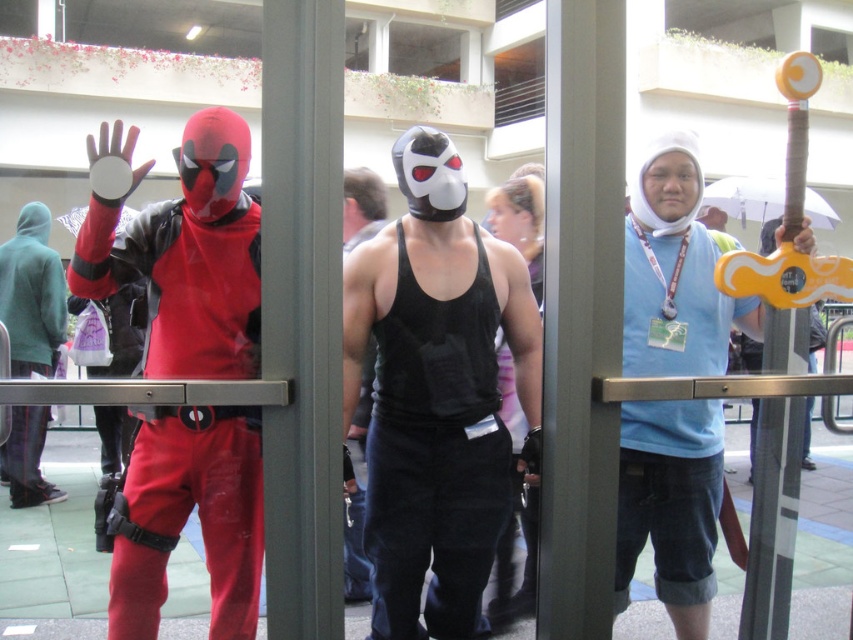
Describe the element at coordinates (436, 394) in the screenshot. I see `black matte tank top at center` at that location.

Who is more forward, (413, 563) or (657, 372)?

Positioned in front is point (413, 563).

Where is `black matte tank top at center`? This screenshot has height=640, width=853. black matte tank top at center is located at coordinates (436, 394).

Can you confirm if black matte tank top at center is thinner than matte red costume at left?

Yes, black matte tank top at center is thinner than matte red costume at left.

Can you confirm if black matte tank top at center is positioned to the left of matte red costume at left?

In fact, black matte tank top at center is to the right of matte red costume at left.

Is point (421, 227) closer to camera compared to point (252, 317)?

That is False.

At what (x,y) coordinates should I click in order to perform the action: click on black matte tank top at center. Please return your answer as a coordinate pair (x, y). This screenshot has height=640, width=853. Looking at the image, I should click on (436, 394).

Does matte red costume at left have a greater width compared to matte black hoodie at left?

Incorrect, matte red costume at left's width does not surpass matte black hoodie at left's.

Is point (245, 458) in front of point (9, 291)?

Yes, it is.

At what (x,y) coordinates should I click in order to perform the action: click on matte red costume at left. Please return your answer as a coordinate pair (x, y). The image size is (853, 640). Looking at the image, I should click on (187, 257).